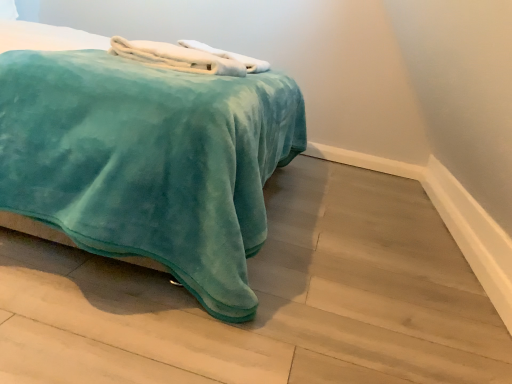
Measure the distance between teal velvety bed at center and camera.

teal velvety bed at center is 39.24 inches from camera.

How much space does white fluffy bath towel at upper center, which is the first bath towel from back to front, occupy vertically?

It is 4.03 inches.

Where is `white soft towel at upper center, the first bath towel in the front-to-back sequence`? The width and height of the screenshot is (512, 384). white soft towel at upper center, the first bath towel in the front-to-back sequence is located at coordinates (187, 57).

Image resolution: width=512 pixels, height=384 pixels. In order to click on teal velvety bed at center in this screenshot , I will do (147, 164).

Is teal velvety bed at center completely or partially outside of white soft towel at upper center, the 2th bath towel when ordered from back to front?

teal velvety bed at center is positioned outside white soft towel at upper center, the 2th bath towel when ordered from back to front.

Is there a large distance between teal velvety bed at center and white soft towel at upper center, the first bath towel in the front-to-back sequence?

teal velvety bed at center is actually quite close to white soft towel at upper center, the first bath towel in the front-to-back sequence.

Considering the relative sizes of teal velvety bed at center and white soft towel at upper center, the 2th bath towel when ordered from back to front, in the image provided, is teal velvety bed at center taller than white soft towel at upper center, the 2th bath towel when ordered from back to front,?

Yes, teal velvety bed at center is taller than white soft towel at upper center, the 2th bath towel when ordered from back to front.

Is white soft towel at upper center, the first bath towel in the front-to-back sequence, positioned before teal velvety bed at center?

No, the depth of white soft towel at upper center, the first bath towel in the front-to-back sequence, is greater than that of teal velvety bed at center.

Could you tell me if white soft towel at upper center, the 2th bath towel when ordered from back to front, is turned towards teal velvety bed at center?

Yes, white soft towel at upper center, the 2th bath towel when ordered from back to front, faces towards teal velvety bed at center.

How many degrees apart are the facing directions of white soft towel at upper center, the first bath towel in the front-to-back sequence, and teal velvety bed at center?

2.58 degrees.

Looking at this image, which object is wider, white soft towel at upper center, the 2th bath towel when ordered from back to front, or teal velvety bed at center?

teal velvety bed at center.

Is teal velvety bed at center situated inside white fluffy bath towel at upper center, the second bath towel when ordered from front to back, or outside?

teal velvety bed at center is outside white fluffy bath towel at upper center, the second bath towel when ordered from front to back.

How many degrees apart are the facing directions of teal velvety bed at center and white fluffy bath towel at upper center, the second bath towel when ordered from front to back?

The angle between the facing direction of teal velvety bed at center and the facing direction of white fluffy bath towel at upper center, the second bath towel when ordered from front to back, is 0.968 degrees.

Is teal velvety bed at center directly adjacent to white fluffy bath towel at upper center, the second bath towel when ordered from front to back?

No, teal velvety bed at center is not in contact with white fluffy bath towel at upper center, the second bath towel when ordered from front to back.

Is teal velvety bed at center in front of or behind white fluffy bath towel at upper center, the second bath towel when ordered from front to back, in the image?

teal velvety bed at center is in front of white fluffy bath towel at upper center, the second bath towel when ordered from front to back.

In terms of size, does white soft towel at upper center, the 2th bath towel when ordered from back to front, appear bigger or smaller than white fluffy bath towel at upper center, which is the first bath towel from back to front?

Considering their sizes, white soft towel at upper center, the 2th bath towel when ordered from back to front, takes up less space than white fluffy bath towel at upper center, which is the first bath towel from back to front.

Is white soft towel at upper center, the 2th bath towel when ordered from back to front, positioned behind white fluffy bath towel at upper center, the second bath towel when ordered from front to back?

No, it is not.

Which of these two, white soft towel at upper center, the first bath towel in the front-to-back sequence, or white fluffy bath towel at upper center, the second bath towel when ordered from front to back, stands shorter?

Standing shorter between the two is white soft towel at upper center, the first bath towel in the front-to-back sequence.

Can you confirm if white fluffy bath towel at upper center, the second bath towel when ordered from front to back, is wider than white soft towel at upper center, the first bath towel in the front-to-back sequence?

Correct, the width of white fluffy bath towel at upper center, the second bath towel when ordered from front to back, exceeds that of white soft towel at upper center, the first bath towel in the front-to-back sequence.

In the scene shown: In terms of size, does white fluffy bath towel at upper center, which is the first bath towel from back to front, appear bigger or smaller than white soft towel at upper center, the 2th bath towel when ordered from back to front?

Considering their sizes, white fluffy bath towel at upper center, which is the first bath towel from back to front, takes up more space than white soft towel at upper center, the 2th bath towel when ordered from back to front.

Find the location of a particular element. Image resolution: width=512 pixels, height=384 pixels. bath towel that appears above the white soft towel at upper center, the first bath towel in the front-to-back sequence (from the image's perspective) is located at coordinates (229, 56).

Is white fluffy bath towel at upper center, the second bath towel when ordered from front to back, completely or partially outside of white soft towel at upper center, the 2th bath towel when ordered from back to front?

Absolutely, white fluffy bath towel at upper center, the second bath towel when ordered from front to back, is external to white soft towel at upper center, the 2th bath towel when ordered from back to front.

Is teal velvety bed at center inside white fluffy bath towel at upper center, which is the first bath towel from back to front?

No, teal velvety bed at center is not surrounded by white fluffy bath towel at upper center, which is the first bath towel from back to front.

From a real-world perspective, between white fluffy bath towel at upper center, the second bath towel when ordered from front to back, and teal velvety bed at center, who is vertically higher?

In real-world perspective, white fluffy bath towel at upper center, the second bath towel when ordered from front to back, is above.

Is point (236, 59) closer or farther from the camera than point (214, 100)?

Point (236, 59) appears to be farther away from the viewer than point (214, 100).

Measure the distance from white fluffy bath towel at upper center, which is the first bath towel from back to front, to teal velvety bed at center.

The distance of white fluffy bath towel at upper center, which is the first bath towel from back to front, from teal velvety bed at center is 35.04 inches.

Identify the location of bed lying in front of the white soft towel at upper center, the 2th bath towel when ordered from back to front. The height and width of the screenshot is (384, 512). (147, 164).

The height and width of the screenshot is (384, 512). I want to click on the 1st bath towel above the teal velvety bed at center (from a real-world perspective), so click(187, 57).

Based on their spatial positions, is teal velvety bed at center or white soft towel at upper center, the first bath towel in the front-to-back sequence, closer to white fluffy bath towel at upper center, the second bath towel when ordered from front to back?

white soft towel at upper center, the first bath towel in the front-to-back sequence, lies closer to white fluffy bath towel at upper center, the second bath towel when ordered from front to back, than the other object.

When comparing their distances from teal velvety bed at center, does white soft towel at upper center, the first bath towel in the front-to-back sequence, or white fluffy bath towel at upper center, which is the first bath towel from back to front, seem further?

The object further to teal velvety bed at center is white fluffy bath towel at upper center, which is the first bath towel from back to front.

Considering their positions, is white soft towel at upper center, the 2th bath towel when ordered from back to front, positioned further to white fluffy bath towel at upper center, which is the first bath towel from back to front, than teal velvety bed at center?

Based on the image, teal velvety bed at center appears to be further to white fluffy bath towel at upper center, which is the first bath towel from back to front.

Based on the photo, which object lies nearer to the anchor point white soft towel at upper center, the 2th bath towel when ordered from back to front, white fluffy bath towel at upper center, which is the first bath towel from back to front, or teal velvety bed at center?

white fluffy bath towel at upper center, which is the first bath towel from back to front, is positioned closer to the anchor white soft towel at upper center, the 2th bath towel when ordered from back to front.

Looking at the image, which one is located closer to white soft towel at upper center, the first bath towel in the front-to-back sequence, teal velvety bed at center or white fluffy bath towel at upper center, which is the first bath towel from back to front?

white fluffy bath towel at upper center, which is the first bath towel from back to front, lies closer to white soft towel at upper center, the first bath towel in the front-to-back sequence, than the other object.

Based on their spatial positions, is white fluffy bath towel at upper center, the second bath towel when ordered from front to back, or white soft towel at upper center, the first bath towel in the front-to-back sequence, closer to teal velvety bed at center?

white soft towel at upper center, the first bath towel in the front-to-back sequence, lies closer to teal velvety bed at center than the other object.

The height and width of the screenshot is (384, 512). I want to click on bath towel between teal velvety bed at center and white fluffy bath towel at upper center, the second bath towel when ordered from front to back, in the front-back direction, so click(187, 57).